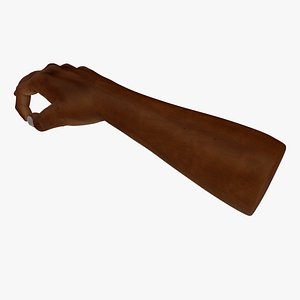
The width and height of the screenshot is (300, 300). Find the location of `corner`. corner is located at coordinates (298, 299), (297, 11), (6, 12), (5, 297).